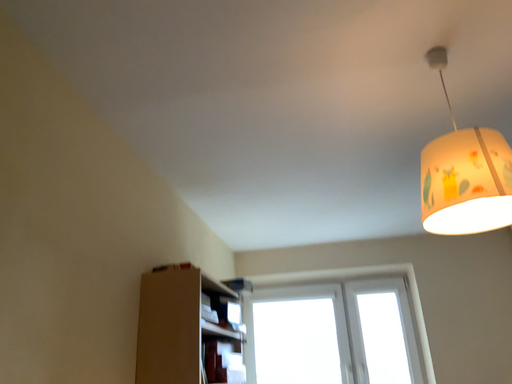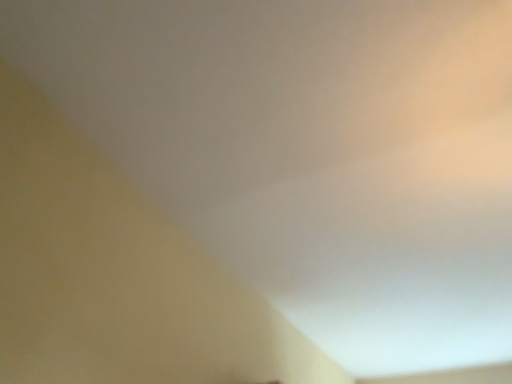
Question: Which way did the camera rotate in the video?

Choices:
 (A) rotated upward
 (B) rotated downward

Answer: (A)